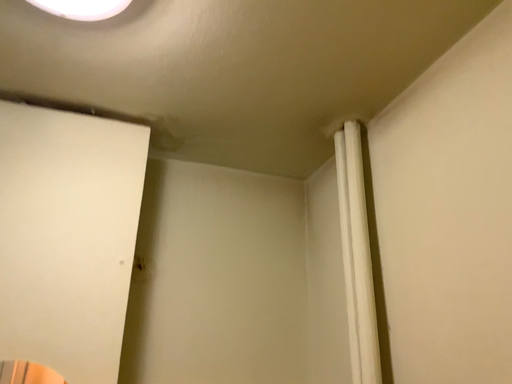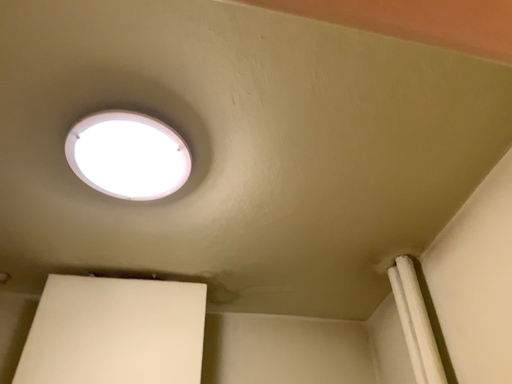
Question: Which way did the camera rotate in the video?

Choices:
 (A) rotated left
 (B) rotated right

Answer: (A)